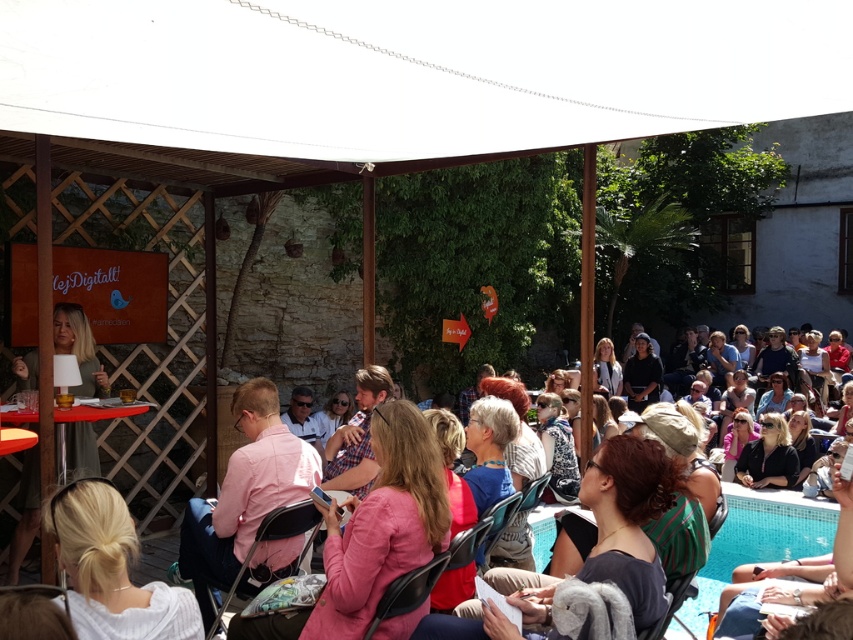
You are organizing a photo shoot and need to ensure that the pink fabric jacket at center and the matte pink shirt at center are visible in the frame. Which clothing item should you adjust to make sure both fit within the camera frame?

Since the pink fabric jacket at center is narrower than the matte pink shirt at center, you should adjust the matte pink shirt at center to ensure both fit within the camera frame.

You are an attendee at the event and want to locate the pink fabric jacket at center and the matte pink shirt at center on stage. Which one is positioned more to the left side?

The pink fabric jacket at center is positioned to the left of the matte pink shirt at center, so the pink fabric jacket at center is more to the left side.